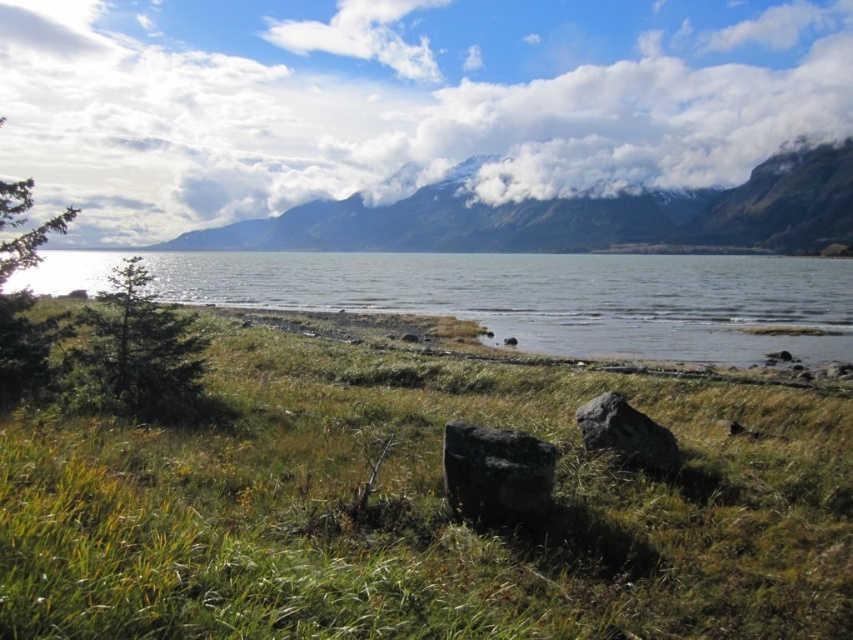
Is clear water at lower center to the right of snowy mountain at upper center from the viewer's perspective?

In fact, clear water at lower center is to the left of snowy mountain at upper center.

From the picture: Is clear water at lower center above snowy mountain at upper center?

No, clear water at lower center is not above snowy mountain at upper center.

Is point (576, 336) positioned in front of point (808, 196)?

Yes, point (576, 336) is in front of point (808, 196).

Where is `clear water at lower center`? The image size is (853, 640). clear water at lower center is located at coordinates (517, 296).

Does green grassy at lower left appear over white fluffy cloud at upper center?

No, green grassy at lower left is not above white fluffy cloud at upper center.

Measure the distance between green grassy at lower left and camera.

3.14 meters

Who is more forward, (146, 499) or (44, 97)?

Positioned in front is point (146, 499).

The height and width of the screenshot is (640, 853). In order to click on green grassy at lower left in this screenshot , I will do `click(421, 509)`.

Is white fluffy cloud at upper center shorter than black rough boulder at center?

No, white fluffy cloud at upper center is not shorter than black rough boulder at center.

Is white fluffy cloud at upper center smaller than black rough boulder at center?

No, white fluffy cloud at upper center is not smaller than black rough boulder at center.

This screenshot has width=853, height=640. Describe the element at coordinates (399, 99) in the screenshot. I see `white fluffy cloud at upper center` at that location.

You are a GUI agent. You are given a task and a screenshot of the screen. Output one action in this format:
    pyautogui.click(x=<x>, y=<y>)
    Task: Click on the white fluffy cloud at upper center
    The height and width of the screenshot is (640, 853).
    Given the screenshot: What is the action you would take?
    pyautogui.click(x=399, y=99)